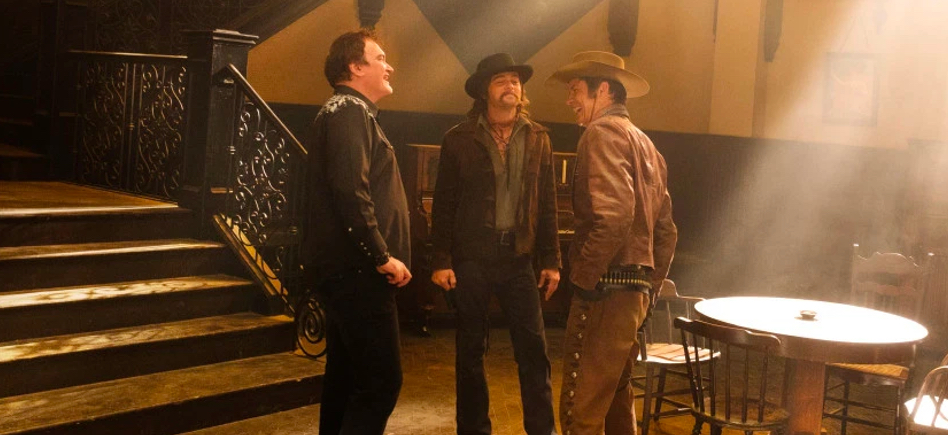
Identify the location of piano. (562, 216).